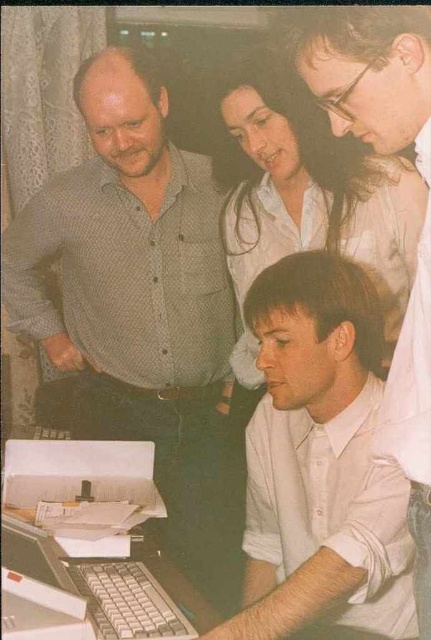
Question: Is gray dotted shirt at left closer to camera compared to white glossy shirt at center?

Choices:
 (A) no
 (B) yes

Answer: (A)

Question: Which of the following is the farthest from the observer?

Choices:
 (A) (28, 333)
 (B) (415, 416)
 (C) (12, 560)

Answer: (A)

Question: Can you confirm if white glossy shirt at center is positioned above white plastic laptop at lower left?

Choices:
 (A) yes
 (B) no

Answer: (A)

Question: Which object appears closest to the camera in this image?

Choices:
 (A) gray dotted shirt at left
 (B) white glossy shirt at center

Answer: (B)

Question: Considering the real-world distances, which object is closest to the white glossy shirt at center?

Choices:
 (A) white plastic laptop at lower left
 (B) gray dotted shirt at left

Answer: (A)

Question: In this image, where is white glossy shirt at center located relative to white plastic laptop at lower left?

Choices:
 (A) right
 (B) left

Answer: (A)